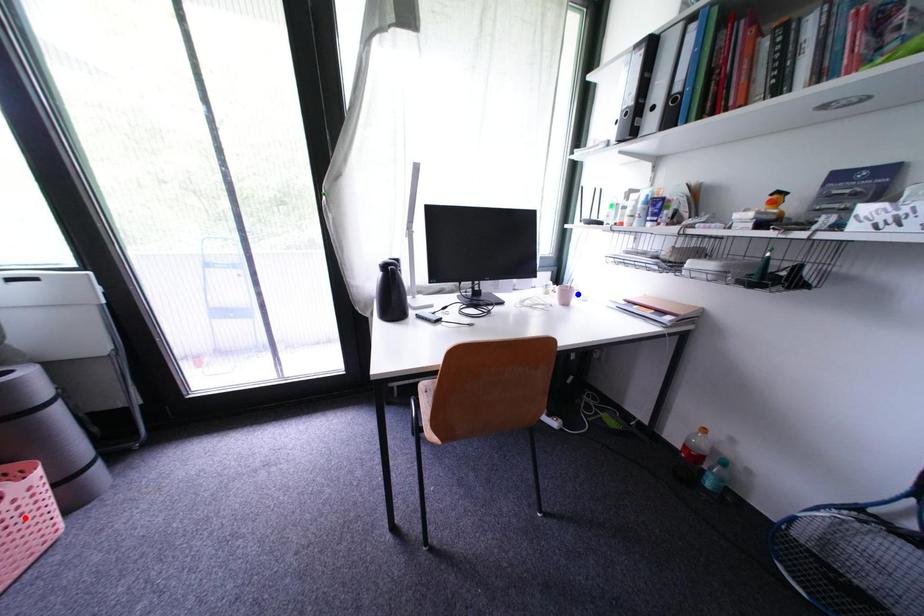
Question: Which of the two points in the image is closer to the camera?

Choices:
 (A) Blue point is closer.
 (B) Red point is closer.

Answer: (B)